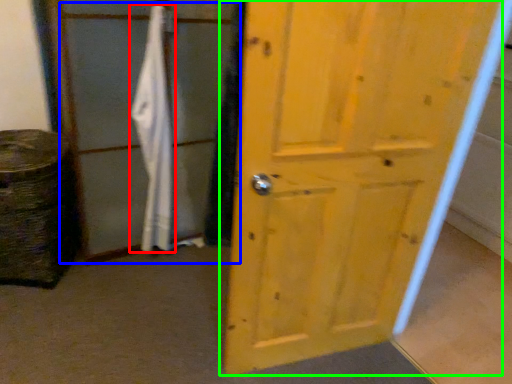
Question: Which object is the closest to the bath towel (highlighted by a red box)? Choose among these: screen door (highlighted by a blue box) or door (highlighted by a green box).

Choices:
 (A) screen door
 (B) door

Answer: (A)